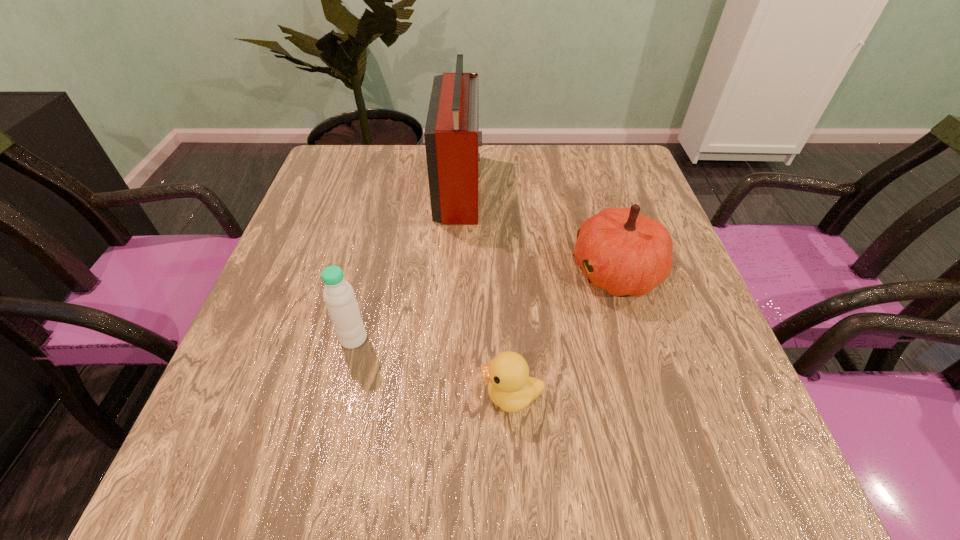
The height and width of the screenshot is (540, 960). In the image, there is a desktop. Find the location of `vacant region at the left edge`. vacant region at the left edge is located at coordinates (297, 323).

In the image, there is a desktop. At what (x,y) coordinates should I click in order to perform the action: click on vacant space at the far left corner. Please return your answer as a coordinate pair (x, y). The height and width of the screenshot is (540, 960). Looking at the image, I should click on (332, 185).

The height and width of the screenshot is (540, 960). Identify the location of vacant region at the far right corner of the desktop. pyautogui.click(x=625, y=147).

Image resolution: width=960 pixels, height=540 pixels. I want to click on free point between the rightmost object and the nearest object, so click(x=564, y=334).

Find the location of a particular element. The height and width of the screenshot is (540, 960). unoccupied area between the duck and the rightmost object is located at coordinates (564, 334).

Image resolution: width=960 pixels, height=540 pixels. What are the coordinates of `empty space between the water bottle and the tallest object` in the screenshot? It's located at (406, 262).

Locate an element on the screen. free spot between the radio receiver and the water bottle is located at coordinates (406, 262).

This screenshot has height=540, width=960. Find the location of `vacant space in between the tallest object and the pumpkin`. vacant space in between the tallest object and the pumpkin is located at coordinates (538, 229).

Where is `unoccupied area between the farthest object and the third farthest object`? unoccupied area between the farthest object and the third farthest object is located at coordinates (406, 262).

The width and height of the screenshot is (960, 540). Identify the location of vacant area that lies between the duck and the leftmost object. (433, 367).